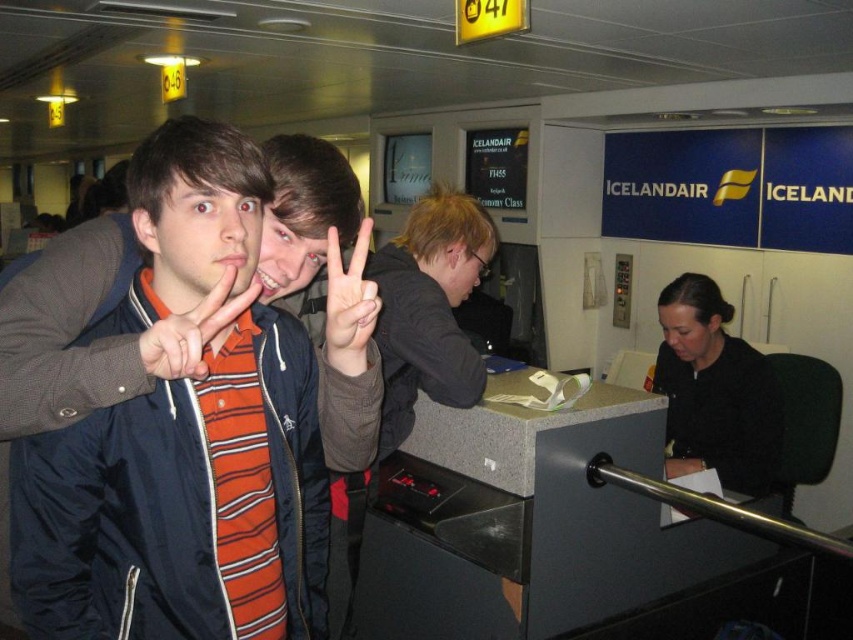
You are an airport staff member trying to guide passengers to the correct gate. You see the matte blue jacket at center and the matte orange shirt at center in your line of sight. Which object is wider from your perspective?

The matte blue jacket at center might be wider than matte orange shirt at center according to the description provided.

You are an airport security agent checking the width of two orange shirts. You have a 1 meter wide conveyor belt. The shirts are the matte orange shirt at center and the matte orange striped shirt at center. Can both shirts fit side by side on the conveyor belt without overlapping?

The matte orange shirt at center might be wider than matte orange striped shirt at center. Since their widths are uncertain, it is possible that together they exceed the 1 meter width of the conveyor belt. To ensure safety, check their combined width before placing them side by side.

You are an airport staff member who needs to distinguish between two passengers wearing similar orange shirts. The passengers are the matte orange shirt at center and the matte orange striped shirt at center. Which one is closer to the ground?

The matte orange shirt at center is positioned under the matte orange striped shirt at center, so the matte orange shirt at center is closer to the ground.